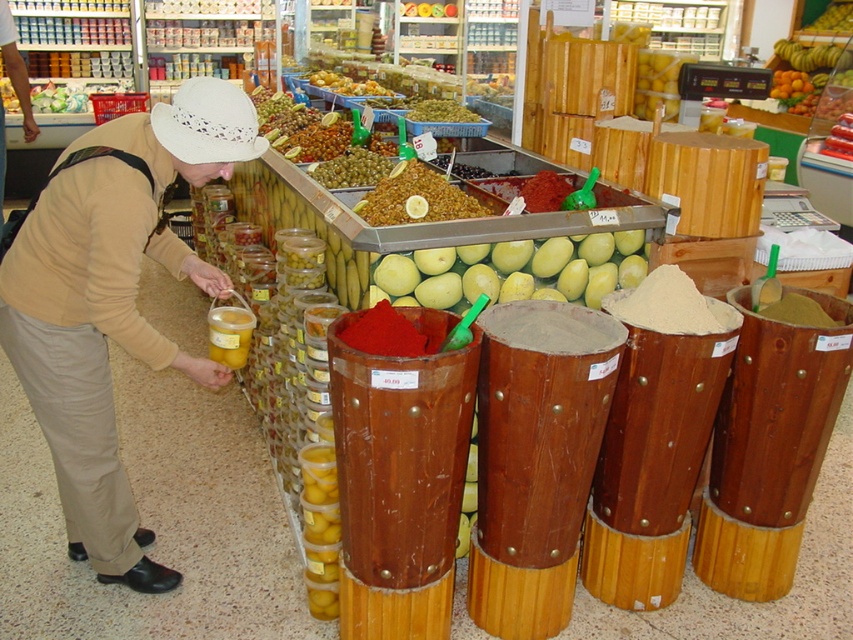
Which is above, beige sweater at center or green matte olives at center?

Positioned higher is green matte olives at center.

Is beige sweater at center wider than green matte olives at center?

Yes, beige sweater at center is wider than green matte olives at center.

Identify the location of beige sweater at center. The image size is (853, 640). (112, 301).

Who is more distant from viewer, (107, 205) or (437, 112)?

The point (437, 112) is behind.

Where is `beige sweater at center`? Image resolution: width=853 pixels, height=640 pixels. beige sweater at center is located at coordinates (112, 301).

Where is `beige sweater at center`? The image size is (853, 640). beige sweater at center is located at coordinates (112, 301).

Does green matte olives at center come behind green olive at center?

No.

Between point (415, 212) and point (450, 108), which one is positioned in front?

Positioned in front is point (415, 212).

The image size is (853, 640). I want to click on green matte olives at center, so click(x=416, y=196).